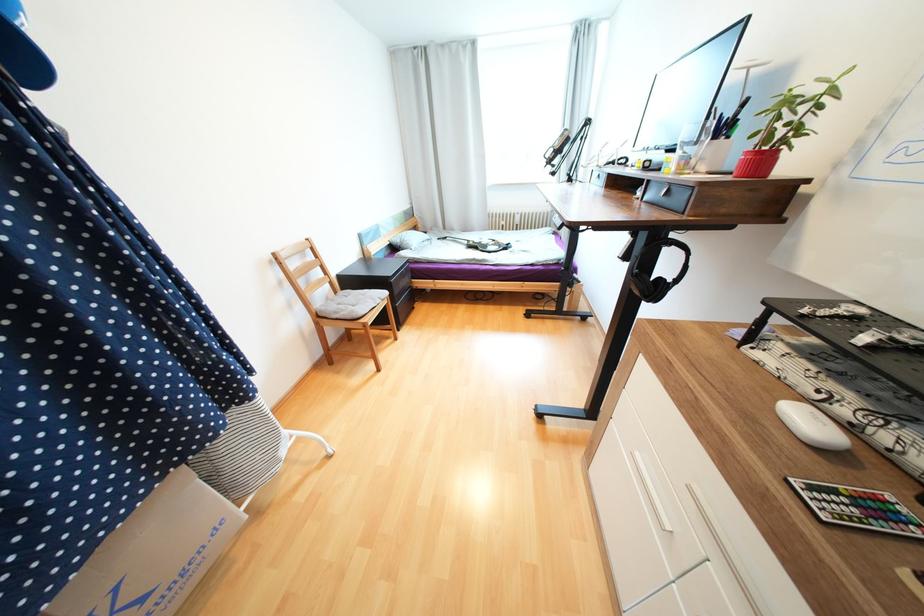
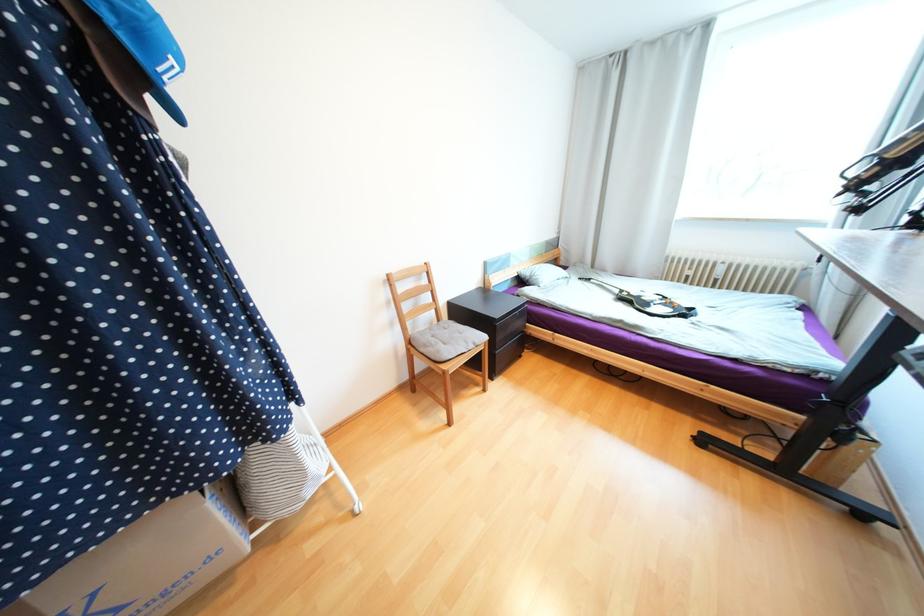
In the second image, find the point that corresponds to pixel 379 300 in the first image.

(472, 342)